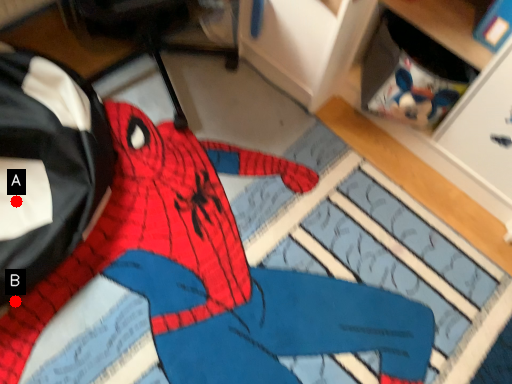
Question: Two points are circled on the image, labeled by A and B beside each circle. Which point is closer to the camera?

Choices:
 (A) A is closer
 (B) B is closer

Answer: (B)